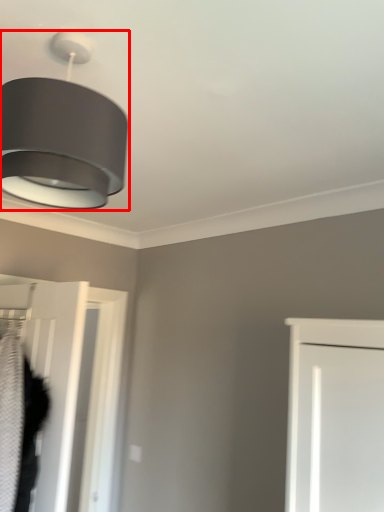
Question: From the image's perspective, where is lamp (annotated by the red box) located in relation to door in the image?

Choices:
 (A) below
 (B) above

Answer: (B)